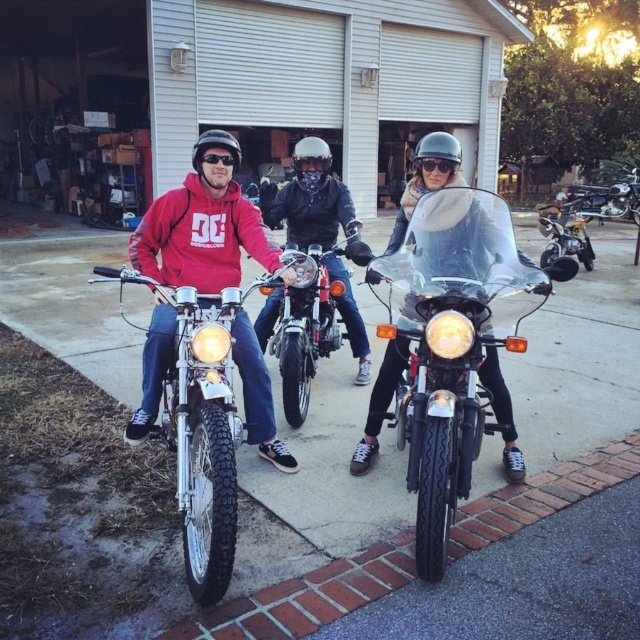
Question: Among these objects, which one is farthest from the camera?

Choices:
 (A) glossy black helmet at center
 (B) black matte goggles at center

Answer: (A)

Question: Is gold metallic motorcycle at center above glossy black helmet at center?

Choices:
 (A) no
 (B) yes

Answer: (A)

Question: Does gold metallic motorcycle at center appear on the left side of white matte helmet at center?

Choices:
 (A) no
 (B) yes

Answer: (A)

Question: Which of the following is the farthest from the observer?

Choices:
 (A) (157, 433)
 (B) (499, 257)
 (C) (323, 176)

Answer: (C)

Question: Among these objects, which one is farthest from the camera?

Choices:
 (A) black matte goggles at center
 (B) matte black motorcycle at left

Answer: (A)

Question: Is transparent plastic windshield at center above gold metallic motorcycle at center?

Choices:
 (A) yes
 (B) no

Answer: (B)